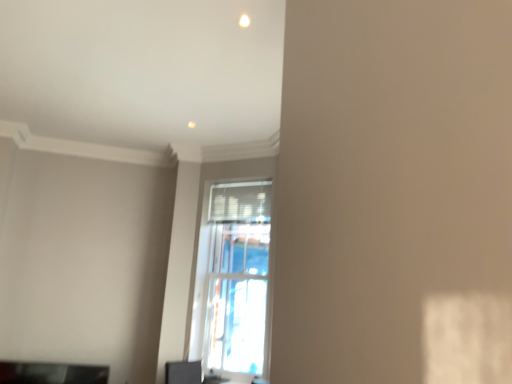
You are a GUI agent. You are given a task and a screenshot of the screen. Output one action in this format:
    pyautogui.click(x=<x>, y=<y>)
    Task: Click on the clear glass window at center
    The image size is (512, 384).
    Given the screenshot: What is the action you would take?
    pyautogui.click(x=233, y=278)

What do you see at coordinates (233, 278) in the screenshot? The height and width of the screenshot is (384, 512). I see `clear glass window at center` at bounding box center [233, 278].

The height and width of the screenshot is (384, 512). Identify the location of clear glass window at center. (x=233, y=278).